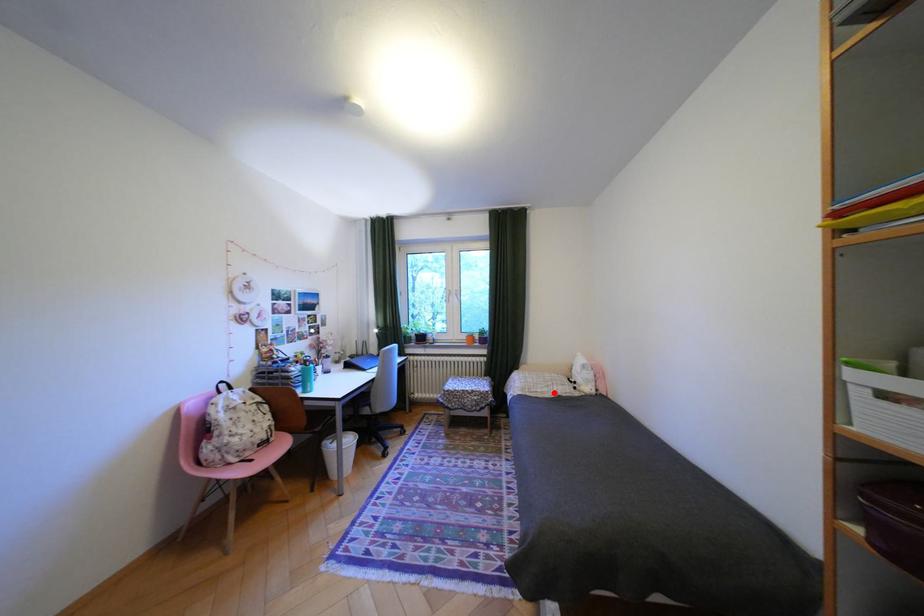
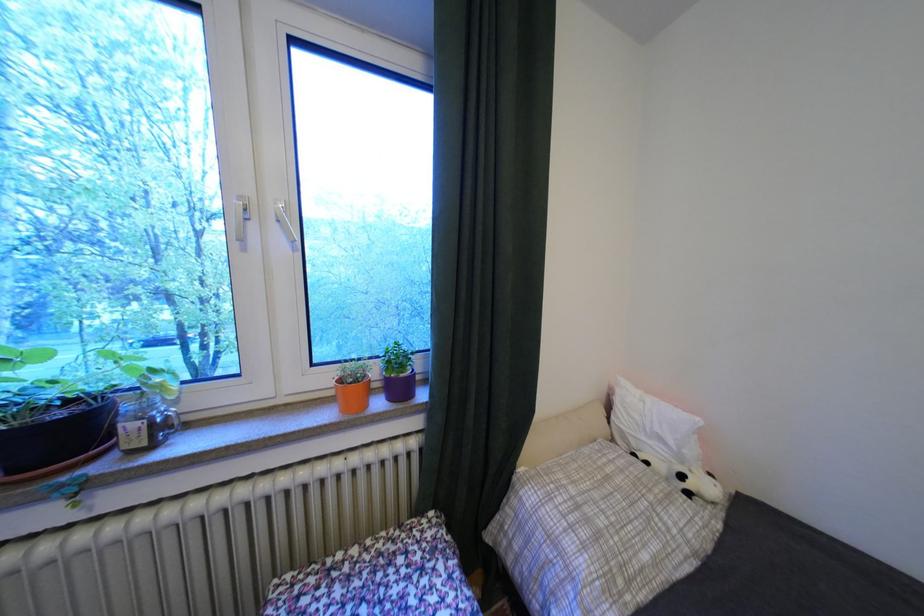
Question: I am providing you with two images of the same scene from different viewpoints. Image1 has a red point marked. In image2, the corresponding 3D location appears at what relative position? Reply with the corresponding letter.

Choices:
 (A) Closer
 (B) Farther

Answer: (A)